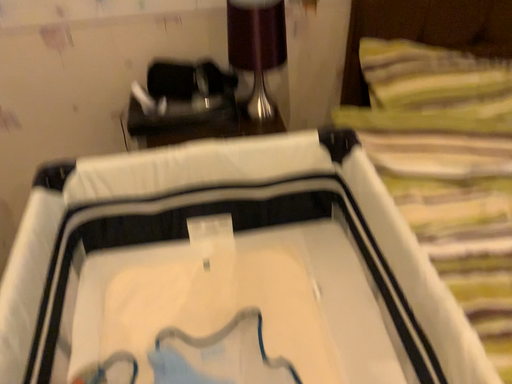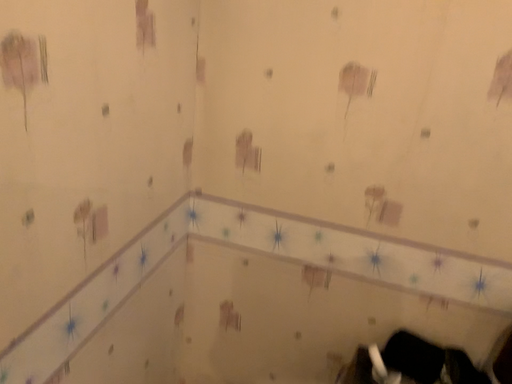
Question: How did the camera likely rotate when shooting the video?

Choices:
 (A) rotated upward
 (B) rotated downward

Answer: (A)